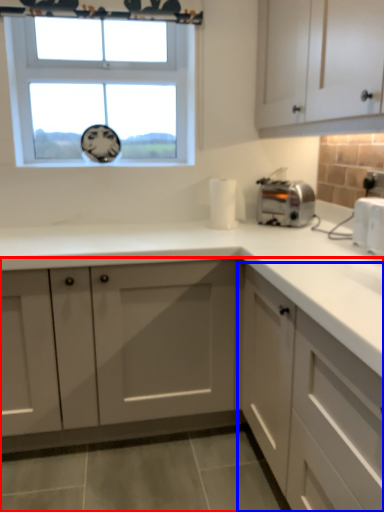
Question: Which point is closer to the camera, cabinetry (highlighted by a red box) or cabinetry (highlighted by a blue box)?

Choices:
 (A) cabinetry
 (B) cabinetry

Answer: (B)